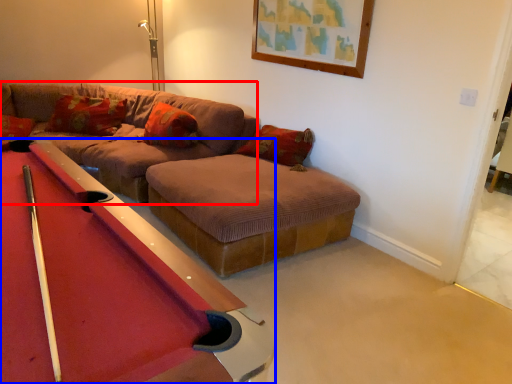
Question: Which of the following is the closest to the observer, couch (highlighted by a red box) or billiard table (highlighted by a blue box)?

Choices:
 (A) couch
 (B) billiard table

Answer: (B)